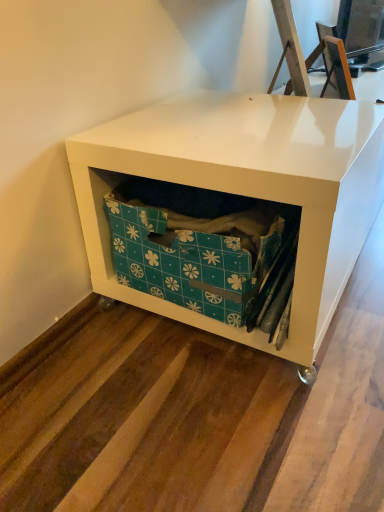
Question: In terms of size, does teal floral-patterned box at center appear bigger or smaller than white glossy storage unit at center?

Choices:
 (A) small
 (B) big

Answer: (A)

Question: From a real-world perspective, is teal floral-patterned box at center physically located above or below white glossy storage unit at center?

Choices:
 (A) below
 (B) above

Answer: (B)

Question: Relative to white glossy storage unit at center, is teal floral-patterned box at center in front or behind?

Choices:
 (A) front
 (B) behind

Answer: (B)

Question: Is white glossy storage unit at center to the left or to the right of teal floral-patterned box at center in the image?

Choices:
 (A) left
 (B) right

Answer: (B)

Question: Is white glossy storage unit at center taller or shorter than teal floral-patterned box at center?

Choices:
 (A) short
 (B) tall

Answer: (B)

Question: Looking at the image, does white glossy storage unit at center seem bigger or smaller compared to teal floral-patterned box at center?

Choices:
 (A) small
 (B) big

Answer: (B)

Question: Is white glossy storage unit at center wider or thinner than teal floral-patterned box at center?

Choices:
 (A) wide
 (B) thin

Answer: (A)